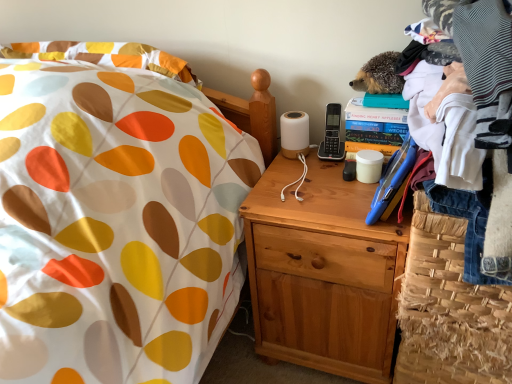
Question: From a real-world perspective, is natural wood nightstand at center on top of woven straw basket at lower right?

Choices:
 (A) yes
 (B) no

Answer: (A)

Question: Does natural wood nightstand at center have a larger size compared to woven straw basket at lower right?

Choices:
 (A) no
 (B) yes

Answer: (B)

Question: Is natural wood nightstand at center in contact with woven straw basket at lower right?

Choices:
 (A) yes
 (B) no

Answer: (B)

Question: Is natural wood nightstand at center smaller than woven straw basket at lower right?

Choices:
 (A) no
 (B) yes

Answer: (A)

Question: Considering the relative sizes of natural wood nightstand at center and woven straw basket at lower right in the image provided, is natural wood nightstand at center wider than woven straw basket at lower right?

Choices:
 (A) yes
 (B) no

Answer: (A)

Question: Is woven straw basket at lower right in front of or behind white cotton shirt at upper right in the image?

Choices:
 (A) front
 (B) behind

Answer: (B)

Question: Looking at the image, does woven straw basket at lower right seem bigger or smaller compared to white cotton shirt at upper right?

Choices:
 (A) small
 (B) big

Answer: (A)

Question: Is woven straw basket at lower right inside or outside of white cotton shirt at upper right?

Choices:
 (A) inside
 (B) outside

Answer: (B)

Question: Visually, is woven straw basket at lower right positioned to the left or to the right of white cotton shirt at upper right?

Choices:
 (A) right
 (B) left

Answer: (A)

Question: Is natural wood nightstand at center inside or outside of white cotton shirt at upper right?

Choices:
 (A) inside
 (B) outside

Answer: (B)

Question: Is natural wood nightstand at center wider or thinner than white cotton shirt at upper right?

Choices:
 (A) wide
 (B) thin

Answer: (B)

Question: In the image, is natural wood nightstand at center positioned in front of or behind white cotton shirt at upper right?

Choices:
 (A) behind
 (B) front

Answer: (A)

Question: From the image's perspective, is natural wood nightstand at center above or below white cotton shirt at upper right?

Choices:
 (A) above
 (B) below

Answer: (B)

Question: From a real-world perspective, relative to natural wood nightstand at center, is woven straw basket at lower right vertically above or below?

Choices:
 (A) below
 (B) above

Answer: (A)

Question: Looking at their shapes, would you say woven straw basket at lower right is wider or thinner than natural wood nightstand at center?

Choices:
 (A) thin
 (B) wide

Answer: (A)